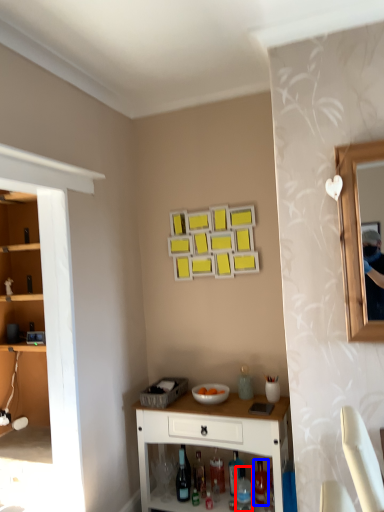
Question: Which object appears farthest to the camera in this image, bottle (highlighted by a red box) or bottle (highlighted by a blue box)?

Choices:
 (A) bottle
 (B) bottle

Answer: (B)